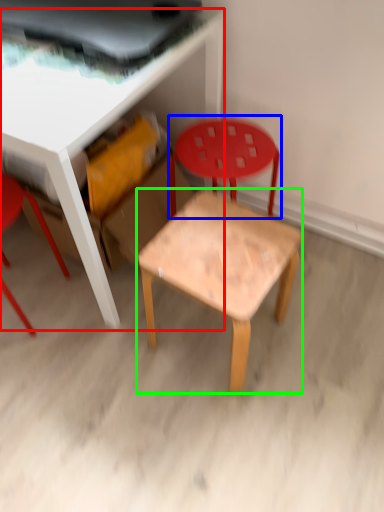
Question: Considering the real-world distances, which object is farthest from table (highlighted by a red box)? chair (highlighted by a blue box) or side table (highlighted by a green box)?

Choices:
 (A) chair
 (B) side table

Answer: (B)